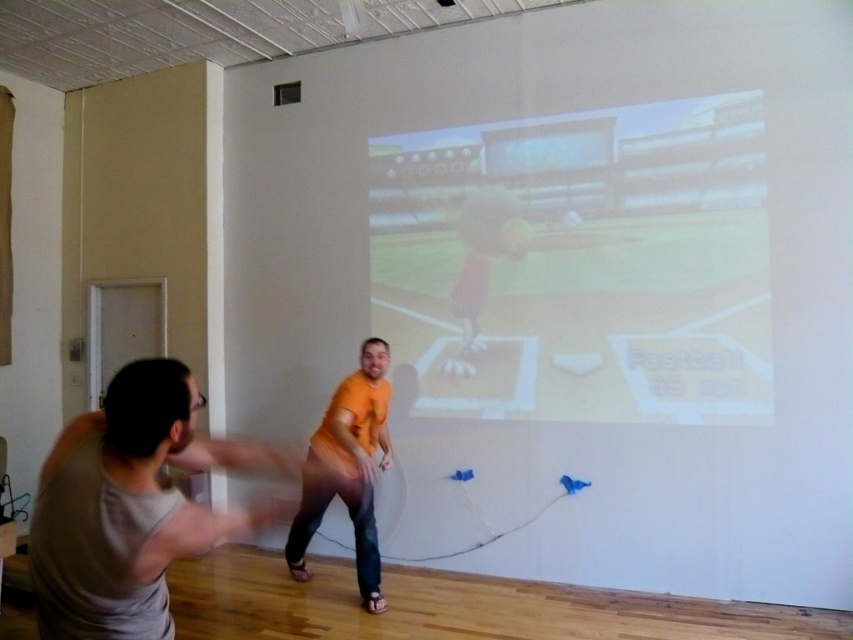
Can you confirm if gray fabric shirt at left is smaller than orange matte shirt at center?

Indeed, gray fabric shirt at left has a smaller size compared to orange matte shirt at center.

Does gray fabric shirt at left appear over orange matte shirt at center?

Indeed, gray fabric shirt at left is positioned over orange matte shirt at center.

Identify the location of gray fabric shirt at left. (131, 508).

Image resolution: width=853 pixels, height=640 pixels. I want to click on gray fabric shirt at left, so click(131, 508).

Is point (740, 326) farther from viewer compared to point (367, 499)?

Yes, point (740, 326) is farther from viewer.

Does matte plastic projection screen at center lie behind orange matte shirt at center?

Yes, matte plastic projection screen at center is further from the viewer.

Find the location of a particular element. This screenshot has height=640, width=853. matte plastic projection screen at center is located at coordinates (579, 262).

Does matte plastic projection screen at center have a greater width compared to gray fabric shirt at left?

Yes, matte plastic projection screen at center is wider than gray fabric shirt at left.

In the scene shown: Is matte plastic projection screen at center in front of gray fabric shirt at left?

That is False.

Is point (703, 352) positioned behind point (54, 468)?

Yes, it is behind point (54, 468).

Identify the location of matte plastic projection screen at center. The height and width of the screenshot is (640, 853). (579, 262).